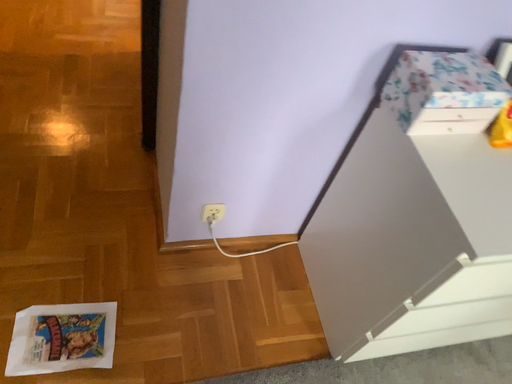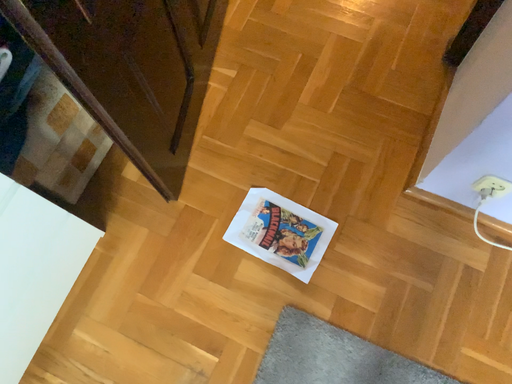
Question: How did the camera likely rotate when shooting the video?

Choices:
 (A) rotated right
 (B) rotated left

Answer: (B)